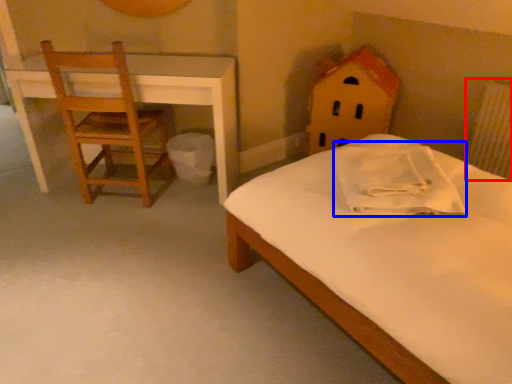
Question: Which object appears closest to the camera in this image, radiator (highlighted by a red box) or pillow (highlighted by a blue box)?

Choices:
 (A) radiator
 (B) pillow

Answer: (B)